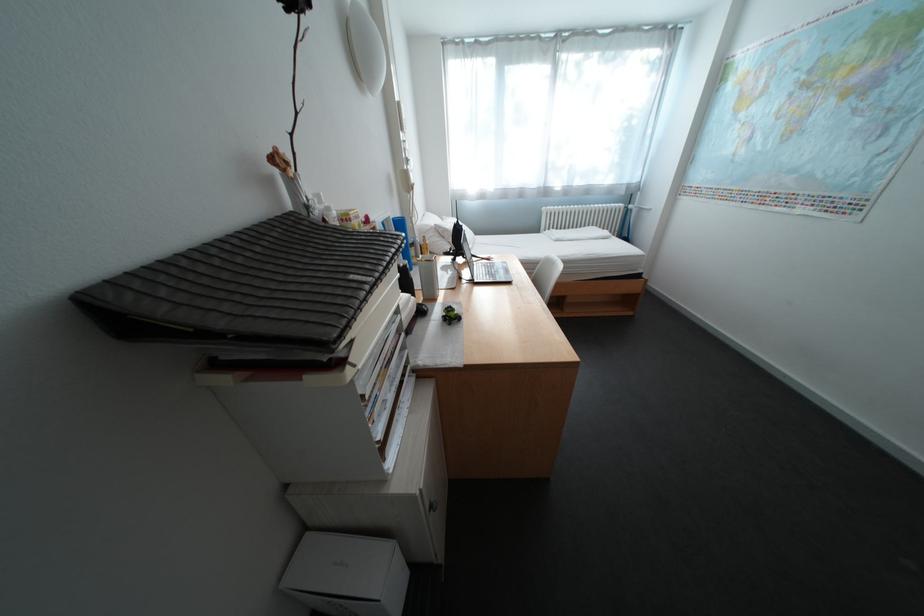
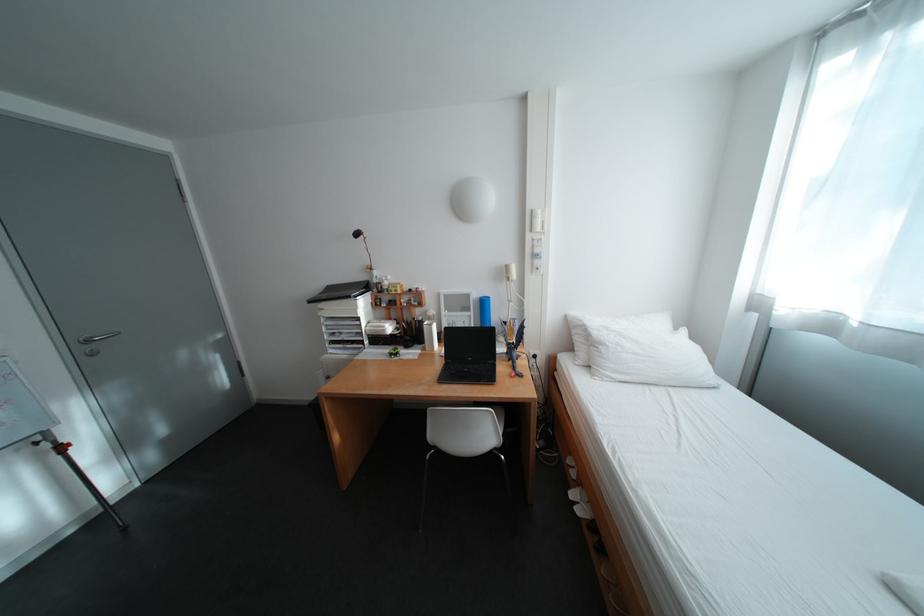
Find the pixel in the second image that matches (411,105) in the first image.

(544, 213)